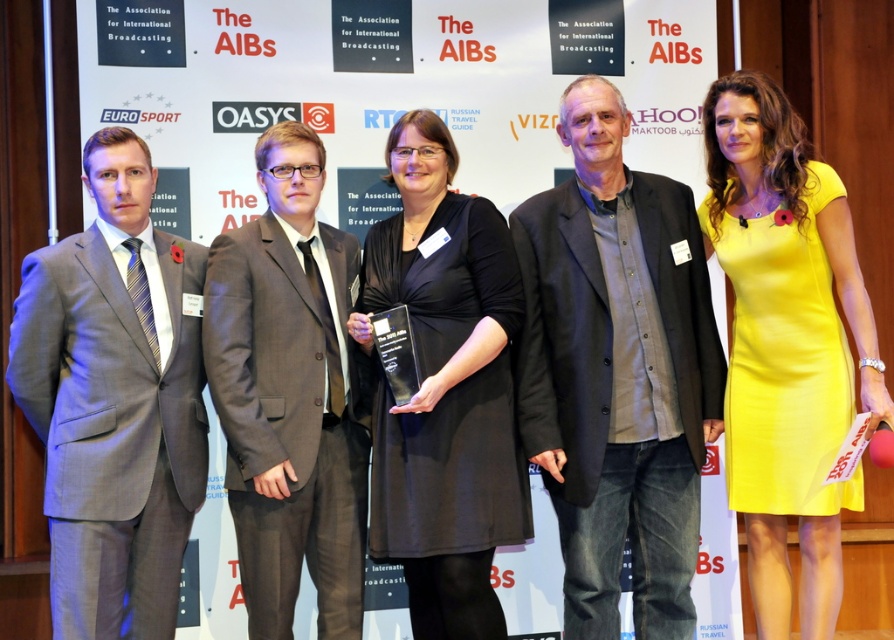
Question: Which object is positioned farthest from the yellow satin dress at right?

Choices:
 (A) gray suit at left
 (B) black matte dress at center
 (C) dark gray button-up shirt at center

Answer: (A)

Question: Which object is farther from the camera taking this photo?

Choices:
 (A) dark gray button-up shirt at center
 (B) black matte dress at center
 (C) dark gray suit at center
 (D) gray suit at left

Answer: (A)

Question: Which is nearer to the dark gray suit at center?

Choices:
 (A) gray suit at left
 (B) black matte dress at center
 (C) dark gray button-up shirt at center
 (D) yellow satin dress at right

Answer: (B)

Question: Can you confirm if yellow satin dress at right is smaller than dark gray suit at center?

Choices:
 (A) no
 (B) yes

Answer: (A)

Question: Where is gray suit at left located in relation to black matte dress at center in the image?

Choices:
 (A) left
 (B) right

Answer: (A)

Question: Observing the image, what is the correct spatial positioning of dark gray suit at center in reference to black matte dress at center?

Choices:
 (A) right
 (B) left

Answer: (B)